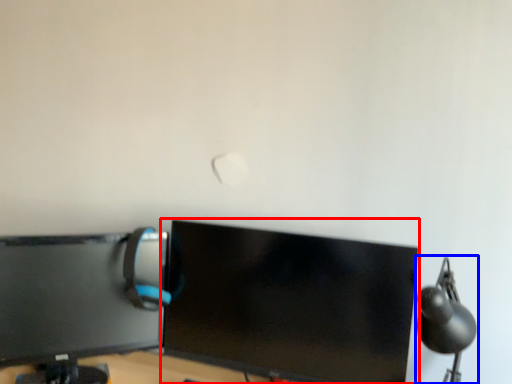
Question: Among these objects, which one is farthest to the camera, computer monitor (highlighted by a red box) or table lamp (highlighted by a blue box)?

Choices:
 (A) computer monitor
 (B) table lamp

Answer: (A)